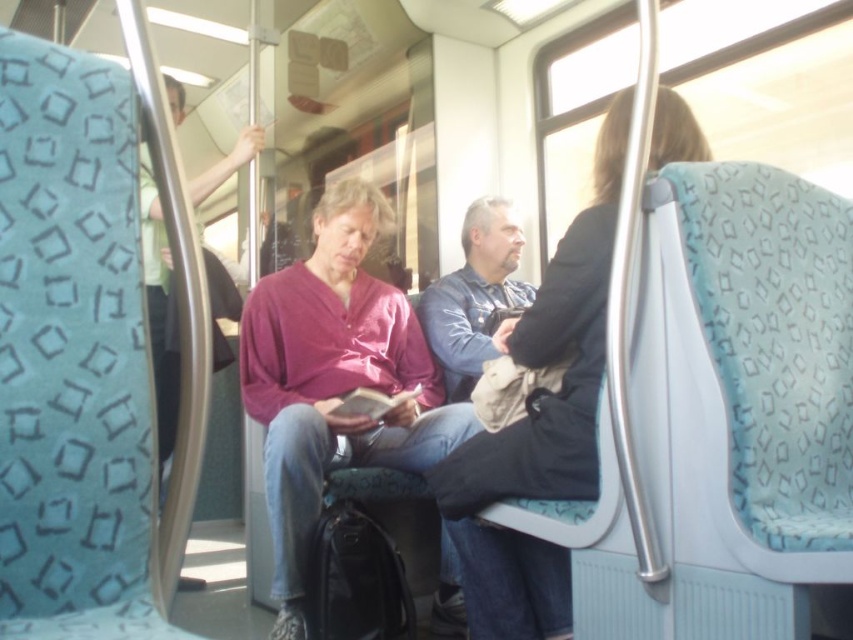
Question: Is black fabric jacket at center positioned at the back of blue denim jacket at center?

Choices:
 (A) yes
 (B) no

Answer: (B)

Question: Which object is positioned closest to the blue denim jacket at center?

Choices:
 (A) matte purple sweater at center
 (B) black fabric jacket at center

Answer: (A)

Question: Which object is farther from the camera taking this photo?

Choices:
 (A) matte purple sweater at center
 (B) blue denim jacket at center

Answer: (B)

Question: Does matte purple sweater at center lie in front of blue denim jacket at center?

Choices:
 (A) yes
 (B) no

Answer: (A)

Question: Which object is positioned closest to the matte purple sweater at center?

Choices:
 (A) blue denim jacket at center
 (B) black fabric jacket at center

Answer: (A)

Question: Can you confirm if matte purple sweater at center is positioned to the right of blue denim jacket at center?

Choices:
 (A) yes
 (B) no

Answer: (B)